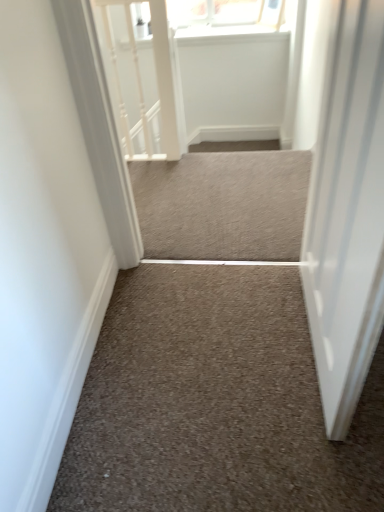
This screenshot has height=512, width=384. What are the coordinates of `white glossy door at right` in the screenshot? It's located at (347, 212).

Describe the element at coordinates (347, 212) in the screenshot. I see `white glossy door at right` at that location.

What is the approximate height of white textured rail at upper left?

88.69 centimeters.

This screenshot has width=384, height=512. Find the location of `white textured rail at upper left`. white textured rail at upper left is located at coordinates (140, 76).

Identify the location of neutral carpet at center, which appears as the 2th stairwell when viewed from the back. (214, 403).

Is neutral carpet at center, the second stairwell positioned from the top, turned away from white glossy door at right?

neutral carpet at center, the second stairwell positioned from the top, is not turned away from white glossy door at right.

Can you confirm if neutral carpet at center, the second stairwell positioned from the top, is shorter than white glossy door at right?

Yes.

Does neutral carpet at center, the second stairwell positioned from the top, come behind white glossy door at right?

Yes, it is.

Consider the image. Can you confirm if neutral carpet at center, the second stairwell positioned from the top, is positioned to the right of white glossy door at right?

Incorrect, neutral carpet at center, the second stairwell positioned from the top, is not on the right side of white glossy door at right.

You are a GUI agent. You are given a task and a screenshot of the screen. Output one action in this format:
    pyautogui.click(x=<x>, y=<y>)
    Task: Click on the door above the white textured rail at upper left (from a real-world perspective)
    The width and height of the screenshot is (384, 512).
    Given the screenshot: What is the action you would take?
    pos(347,212)

Which point is more forward, (368, 354) or (175, 108)?

The point (368, 354) is more forward.

From the image's perspective, which one is positioned higher, white glossy door at right or white textured rail at upper left?

white textured rail at upper left, from the image's perspective.

Which is more to the right, white glossy door at right or white textured rail at upper left?

Positioned to the right is white glossy door at right.

Is neutral carpet at center, the 1th stairwell viewed from the front, in contact with white textured rail at upper left?

No, neutral carpet at center, the 1th stairwell viewed from the front, is not making contact with white textured rail at upper left.

Is neutral carpet at center, the 1th stairwell in the bottom-to-top sequence, to the right of white textured rail at upper left from the viewer's perspective?

Correct, you'll find neutral carpet at center, the 1th stairwell in the bottom-to-top sequence, to the right of white textured rail at upper left.

Could white textured rail at upper left be considered to be inside neutral carpet at center, the 1th stairwell in the bottom-to-top sequence?

No.

From the image's perspective, would you say neutral carpet at center, which appears as the 2th stairwell when viewed from the back, is positioned over white textured rail at upper left?

No.

In order to click on door below the white textured rail at upper left (from the image's perspective) in this screenshot , I will do click(x=347, y=212).

Between point (141, 132) and point (311, 249), which one is positioned in front?

The point (311, 249) is closer to the camera.

From the image's perspective, does white textured rail at upper left appear lower than white glossy door at right?

No, from the image's perspective, white textured rail at upper left is not below white glossy door at right.

Looking at this image, from the image's perspective, relative to neutral carpet at center, the 1th stairwell in the bottom-to-top sequence, is white textured rail at upper left above or below?

Based on their image positions, white textured rail at upper left is located above neutral carpet at center, the 1th stairwell in the bottom-to-top sequence.

From the picture: Between white textured rail at upper left and neutral carpet at center, the second stairwell positioned from the top, which one appears on the left side from the viewer's perspective?

From the viewer's perspective, white textured rail at upper left appears more on the left side.

From a real-world perspective, between white textured rail at upper left and neutral carpet at center, the second stairwell positioned from the top, who is vertically lower?

In real-world perspective, neutral carpet at center, the second stairwell positioned from the top, is lower.

Could you measure the distance between neutral carpet at center, the first stairwell when ordered from top to bottom, and neutral carpet at center, which appears as the 2th stairwell when viewed from the back?

neutral carpet at center, the first stairwell when ordered from top to bottom, and neutral carpet at center, which appears as the 2th stairwell when viewed from the back, are 72.50 centimeters apart from each other.

Considering the points (280, 175) and (268, 406), which point is behind, point (280, 175) or point (268, 406)?

The point (280, 175) is farther from the camera.

Are neutral carpet at center, arranged as the second stairwell when viewed from the front, and neutral carpet at center, which appears as the 2th stairwell when viewed from the back, located far from each other?

That's not correct — neutral carpet at center, arranged as the second stairwell when viewed from the front, is a little close to neutral carpet at center, which appears as the 2th stairwell when viewed from the back.

This screenshot has height=512, width=384. In order to click on stairwell to the right of neutral carpet at center, which ranks as the 2th stairwell in bottom-to-top order in this screenshot , I will do `click(214, 403)`.

Consider the image. Is neutral carpet at center, the first stairwell when ordered from top to bottom, inside the boundaries of white glossy door at right, or outside?

neutral carpet at center, the first stairwell when ordered from top to bottom, lies outside white glossy door at right.

Considering the sizes of objects neutral carpet at center, which ranks as the 2th stairwell in bottom-to-top order, and white glossy door at right in the image provided, who is bigger, neutral carpet at center, which ranks as the 2th stairwell in bottom-to-top order, or white glossy door at right?

With larger size is white glossy door at right.

Which of these two, neutral carpet at center, which is the 1th stairwell from back to front, or white glossy door at right, is thinner?

With smaller width is white glossy door at right.

Considering their positions, is neutral carpet at center, arranged as the second stairwell when viewed from the front, located in front of or behind white glossy door at right?

Visually, neutral carpet at center, arranged as the second stairwell when viewed from the front, is located behind white glossy door at right.

Locate an element on the screen. The width and height of the screenshot is (384, 512). door above the neutral carpet at center, which appears as the 2th stairwell when viewed from the back (from a real-world perspective) is located at coordinates (347, 212).

In the image, there is a white glossy door at right. Where is `rail below it (from a real-world perspective)`? The height and width of the screenshot is (512, 384). rail below it (from a real-world perspective) is located at coordinates (140, 76).

In the scene shown: Considering their positions, is white glossy door at right positioned further to neutral carpet at center, which is the 1th stairwell from back to front, than white textured rail at upper left?

Based on the image, white textured rail at upper left appears to be further to neutral carpet at center, which is the 1th stairwell from back to front.

Which object lies further to the anchor point neutral carpet at center, the 1th stairwell viewed from the front, white glossy door at right or neutral carpet at center, which is the 1th stairwell from back to front?

The object further to neutral carpet at center, the 1th stairwell viewed from the front, is neutral carpet at center, which is the 1th stairwell from back to front.

Considering their positions, is white textured rail at upper left positioned closer to neutral carpet at center, the 1th stairwell in the bottom-to-top sequence, than white glossy door at right?

Among the two, white glossy door at right is located nearer to neutral carpet at center, the 1th stairwell in the bottom-to-top sequence.

From the image, which object appears to be farther from white glossy door at right, white textured rail at upper left or neutral carpet at center, which ranks as the 2th stairwell in bottom-to-top order?

Among the two, white textured rail at upper left is located further to white glossy door at right.

Estimate the real-world distances between objects in this image. Which object is closer to neutral carpet at center, which is the 1th stairwell from back to front, neutral carpet at center, the 1th stairwell in the bottom-to-top sequence, or white glossy door at right?

The object closer to neutral carpet at center, which is the 1th stairwell from back to front, is white glossy door at right.

Which object lies nearer to the anchor point white glossy door at right, neutral carpet at center, the 1th stairwell viewed from the front, or white textured rail at upper left?

neutral carpet at center, the 1th stairwell viewed from the front, lies closer to white glossy door at right than the other object.

Estimate the real-world distances between objects in this image. Which object is closer to neutral carpet at center, the first stairwell when ordered from top to bottom, white textured rail at upper left or neutral carpet at center, the 1th stairwell in the bottom-to-top sequence?

white textured rail at upper left.

Looking at the image, which one is located further to white textured rail at upper left, neutral carpet at center, arranged as the second stairwell when viewed from the front, or neutral carpet at center, the 1th stairwell in the bottom-to-top sequence?

neutral carpet at center, the 1th stairwell in the bottom-to-top sequence, is further to white textured rail at upper left.

What are the coordinates of `stairwell located between white glossy door at right and neutral carpet at center, arranged as the second stairwell when viewed from the front, in the depth direction` in the screenshot? It's located at (214, 403).

The image size is (384, 512). Find the location of `stairwell between white textured rail at upper left and neutral carpet at center, which appears as the 2th stairwell when viewed from the back, in the vertical direction`. stairwell between white textured rail at upper left and neutral carpet at center, which appears as the 2th stairwell when viewed from the back, in the vertical direction is located at coordinates click(x=223, y=205).